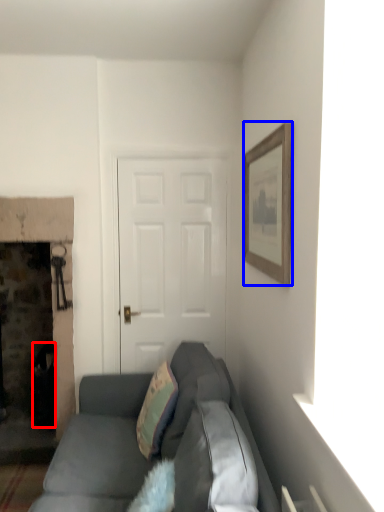
Question: Which object is closer to the camera taking this photo, trash bin/can (highlighted by a red box) or picture frame (highlighted by a blue box)?

Choices:
 (A) trash bin/can
 (B) picture frame

Answer: (B)